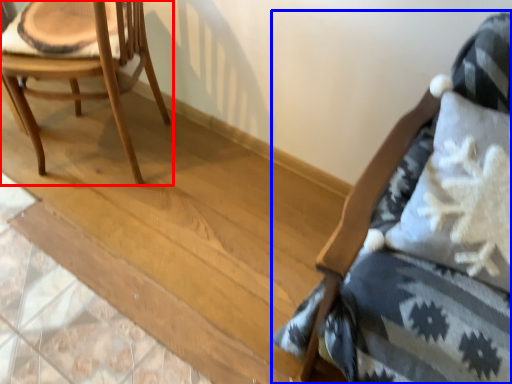
Question: Among these objects, which one is farthest to the camera, chair (highlighted by a red box) or chair (highlighted by a blue box)?

Choices:
 (A) chair
 (B) chair

Answer: (A)